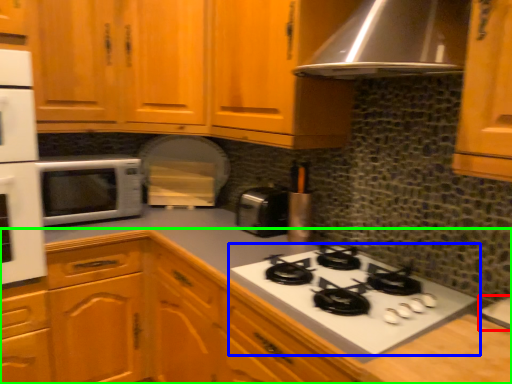
Question: Which object is positioned farthest from sink (highlighted by a red box)? Select from gas stove (highlighted by a blue box) and cabinetry (highlighted by a green box).

Choices:
 (A) gas stove
 (B) cabinetry

Answer: (B)